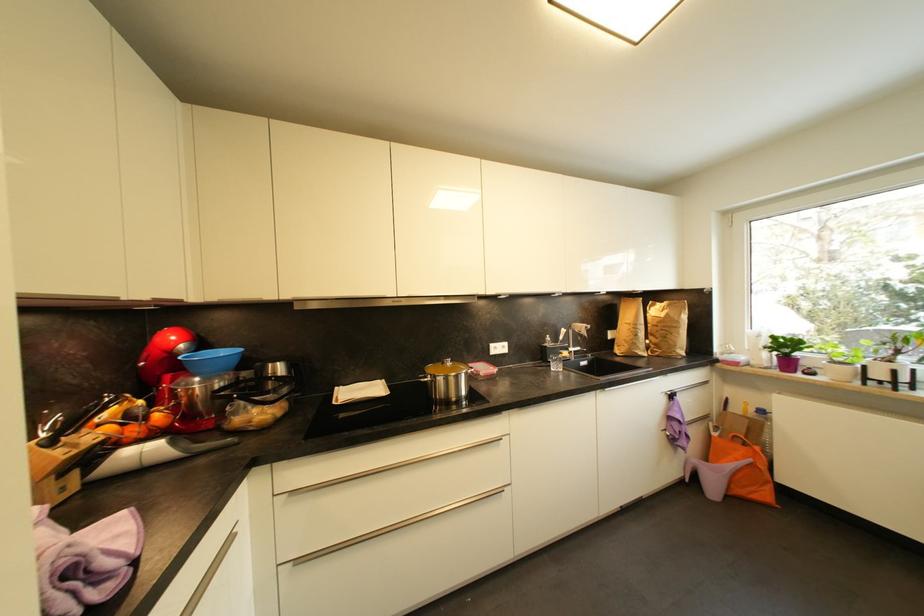
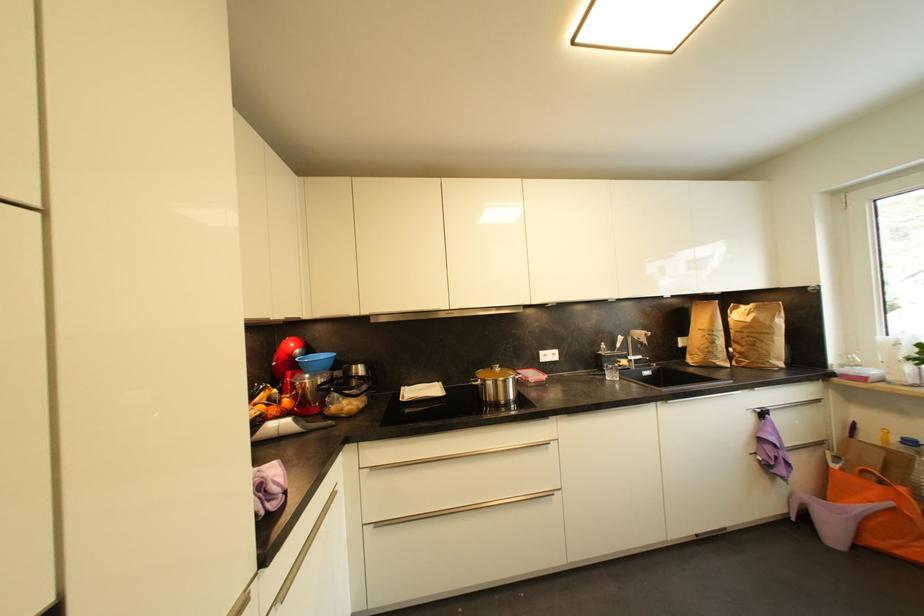
Find the pixel in the second image that matches (x=478, y=363) in the first image.

(528, 371)